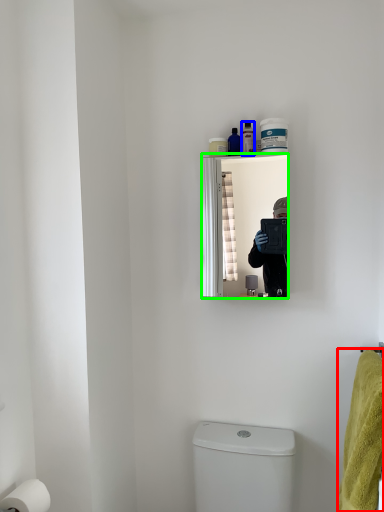
Question: Which is nearer to the bath towel (highlighted by a red box)? toiletry (highlighted by a blue box) or mirror (highlighted by a green box).

Choices:
 (A) toiletry
 (B) mirror

Answer: (B)